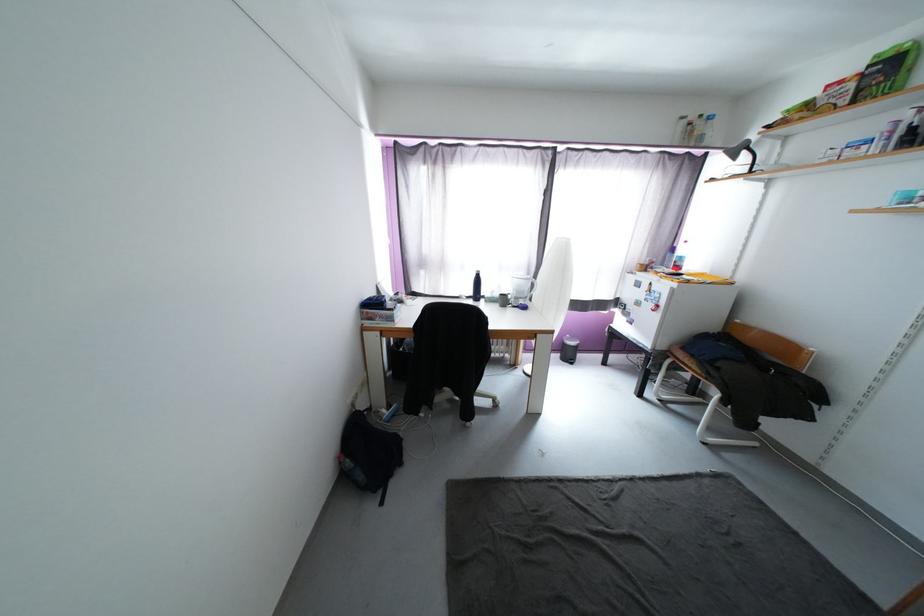
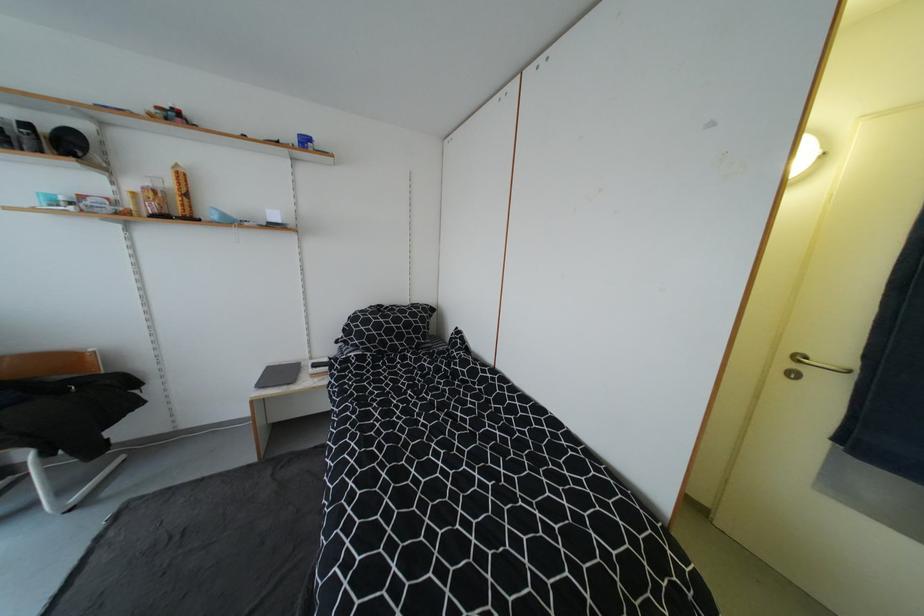
Based on the continuous images, in which direction is the camera rotating?

The camera rotated toward right-down.